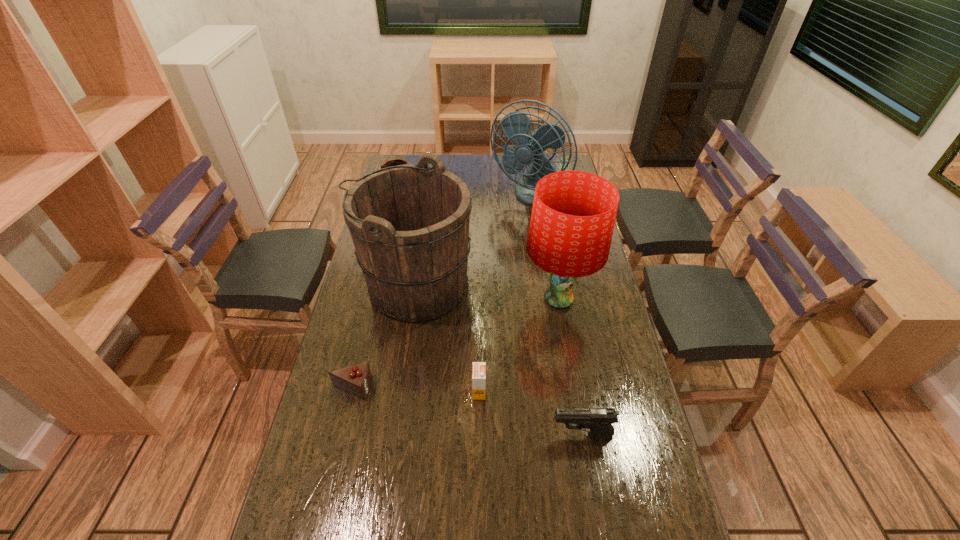
Find the location of a particular element. vacant position located 0.320m on the front-facing side of the lampshade is located at coordinates (428, 300).

You are a GUI agent. You are given a task and a screenshot of the screen. Output one action in this format:
    pyautogui.click(x=<x>, y=<y>)
    Task: Click on the vacant space located 0.120m on the back of the bucket
    
    Given the screenshot: What is the action you would take?
    pyautogui.click(x=423, y=231)

I want to click on free space located on the back of the fourth shortest object, so click(x=410, y=154).

Identify the location of vacant space situated 0.150m at the barrel of the pistol. (493, 435).

Identify the location of free location located at the barrel of the pistol. (456, 435).

At what (x,y) coordinates should I click in order to perform the action: click on free spot located 0.370m at the barrel of the pistol. Please return your answer as a coordinate pair (x, y). Image resolution: width=960 pixels, height=540 pixels. Looking at the image, I should click on (410, 435).

The height and width of the screenshot is (540, 960). Identify the location of vacant space located 0.110m on the back of the fourth object from right to left. click(x=479, y=352).

I want to click on free point located 0.230m on the back of the shortest object, so click(370, 315).

You are a GUI agent. You are given a task and a screenshot of the screen. Output one action in this format:
    pyautogui.click(x=<x>, y=<y>)
    Task: Click on the object positioned at the far edge
    Image resolution: width=960 pixels, height=540 pixels.
    Given the screenshot: What is the action you would take?
    pyautogui.click(x=515, y=125)

The image size is (960, 540). What are the coordinates of `bucket at the left edge` in the screenshot? It's located at (409, 223).